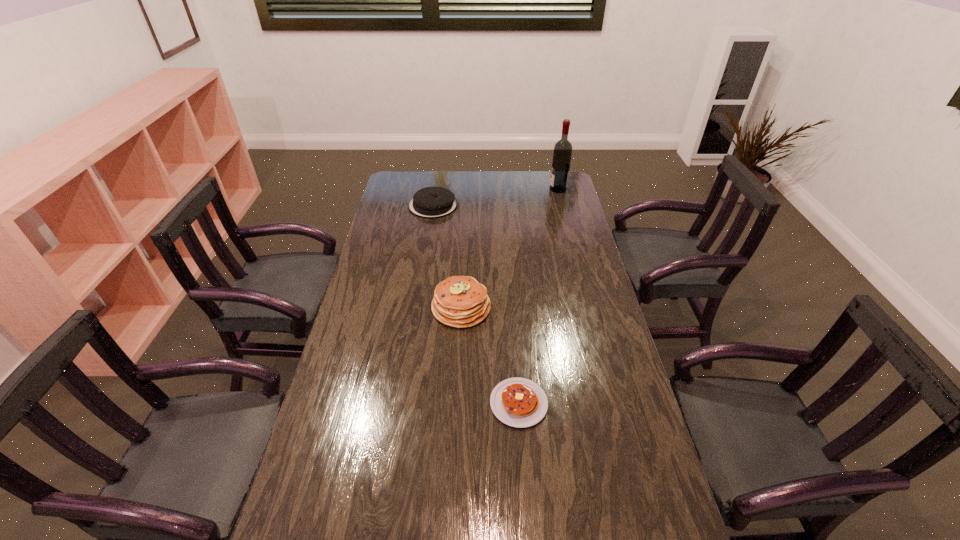
The width and height of the screenshot is (960, 540). What are the coordinates of `the rightmost object` in the screenshot? It's located at (562, 153).

Where is `the tallest object`? The height and width of the screenshot is (540, 960). the tallest object is located at coordinates (562, 153).

Find the location of `the second nearest pancake`. the second nearest pancake is located at coordinates (459, 301).

Where is `the second tallest object`? the second tallest object is located at coordinates (459, 301).

Where is `the farthest pancake`? the farthest pancake is located at coordinates (430, 202).

Identify the location of the second shortest object. The height and width of the screenshot is (540, 960). (430, 202).

In order to click on the nearest pancake in this screenshot , I will do tap(518, 402).

Where is `the nearest object`? the nearest object is located at coordinates (518, 402).

This screenshot has width=960, height=540. Identify the location of free spot located 0.200m on the front and back of the alcohol. (508, 189).

What are the coordinates of `vacant space located on the front and back of the alcohol` in the screenshot? It's located at (468, 189).